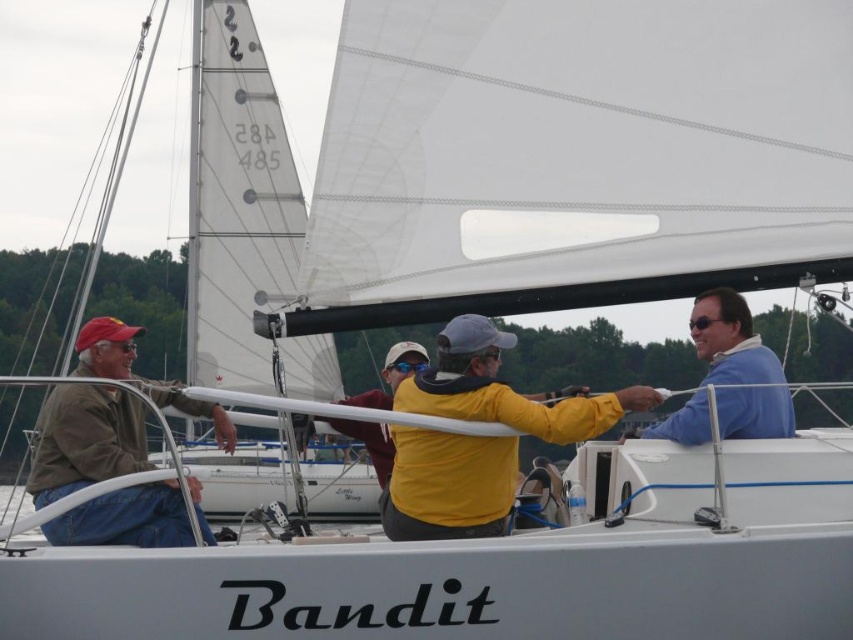
Question: Can you confirm if yellow matte jacket at center is thinner than blue smooth shirt at upper right?

Choices:
 (A) yes
 (B) no

Answer: (B)

Question: Based on their relative distances, which object is farther from the blue smooth shirt at upper right?

Choices:
 (A) brown leather jacket at left
 (B) yellow matte jacket at center

Answer: (A)

Question: Can you confirm if yellow matte jacket at center is wider than brown leather jacket at left?

Choices:
 (A) no
 (B) yes

Answer: (A)

Question: Which is farther from the blue smooth shirt at upper right?

Choices:
 (A) brown leather jacket at left
 (B) yellow matte jacket at center

Answer: (A)

Question: Does yellow matte jacket at center have a lesser width compared to blue smooth shirt at upper right?

Choices:
 (A) no
 (B) yes

Answer: (A)

Question: Which point is farther from the camera taking this photo?

Choices:
 (A) (477, 477)
 (B) (749, 368)

Answer: (B)